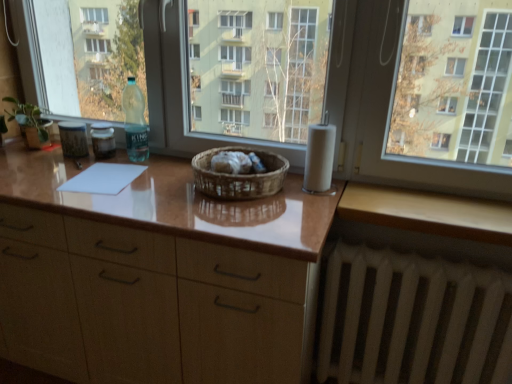
Where is `vacant area that is in front of green matte plant at left`? The height and width of the screenshot is (384, 512). vacant area that is in front of green matte plant at left is located at coordinates (26, 162).